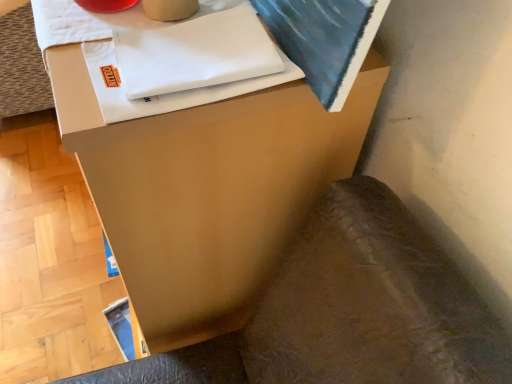
Question: Is matte brown side table at center taller or shorter than brown leather swivel chair at lower right?

Choices:
 (A) short
 (B) tall

Answer: (B)

Question: Is matte brown side table at center inside the boundaries of brown leather swivel chair at lower right, or outside?

Choices:
 (A) inside
 (B) outside

Answer: (B)

Question: From the image's perspective, is matte brown side table at center above or below brown leather swivel chair at lower right?

Choices:
 (A) below
 (B) above

Answer: (B)

Question: From a real-world perspective, is brown leather swivel chair at lower right positioned above or below matte brown side table at center?

Choices:
 (A) above
 (B) below

Answer: (B)

Question: Based on their sizes in the image, would you say brown leather swivel chair at lower right is bigger or smaller than matte brown side table at center?

Choices:
 (A) small
 (B) big

Answer: (A)

Question: Is brown leather swivel chair at lower right in front of or behind matte brown side table at center in the image?

Choices:
 (A) behind
 (B) front

Answer: (B)

Question: Considering the positions of brown leather swivel chair at lower right and matte brown side table at center in the image, is brown leather swivel chair at lower right taller or shorter than matte brown side table at center?

Choices:
 (A) tall
 (B) short

Answer: (B)